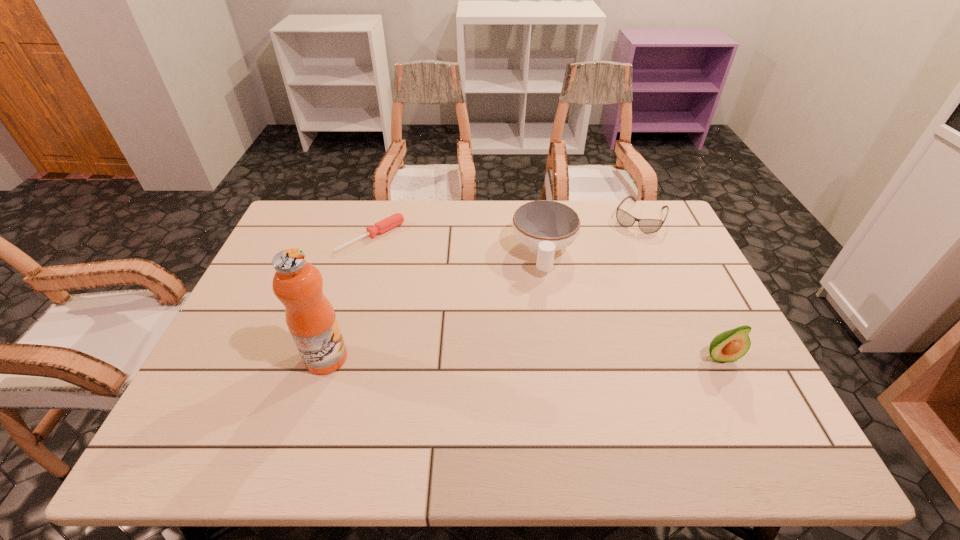
Locate an element on the screen. This screenshot has height=540, width=960. the tallest object is located at coordinates (298, 284).

You are a GUI agent. You are given a task and a screenshot of the screen. Output one action in this format:
    pyautogui.click(x=<x>, y=<y>)
    Task: Click on the avocado
    This screenshot has width=960, height=540.
    Given the screenshot: What is the action you would take?
    pyautogui.click(x=731, y=345)

Find the location of a particular element. This screenshot has width=960, height=540. screwdriver is located at coordinates (396, 219).

Identify the location of the third tallest object. (544, 226).

Locate an element on the screen. the third object from left to right is located at coordinates (544, 226).

Locate an element on the screen. This screenshot has height=540, width=960. the fourth tallest object is located at coordinates (648, 226).

Locate an element on the screen. blank area located on the right of the tallest object is located at coordinates (393, 358).

Locate an element on the screen. vacant space located on the cut side of the avocado is located at coordinates (737, 393).

Find the location of a particular element. The width and height of the screenshot is (960, 540). vacant position located at the tip of the shortest object is located at coordinates (411, 267).

This screenshot has height=540, width=960. I want to click on free space located 0.400m at the tip of the shortest object, so click(x=478, y=321).